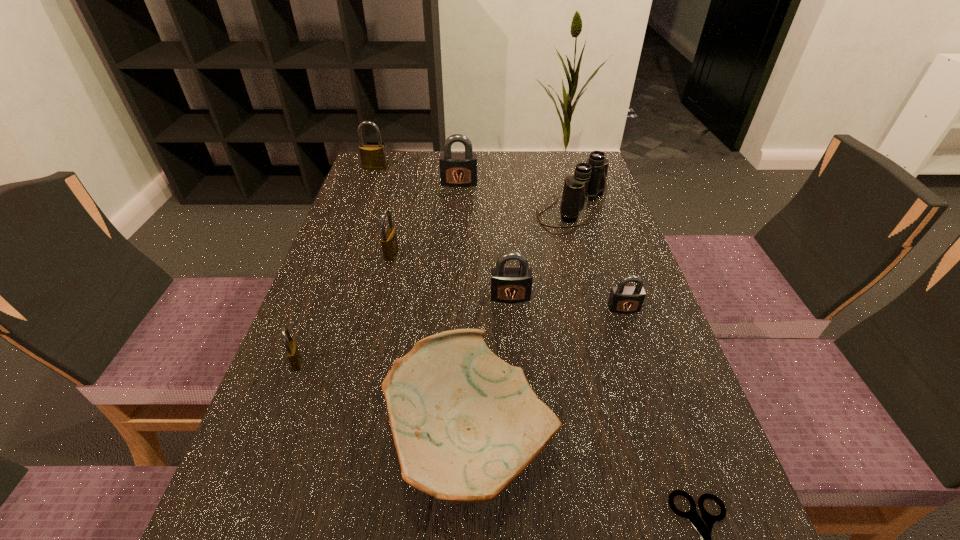
At what (x,y) coordinates should I click in order to perform the action: click on blank area at the far left corner. Please return your answer as a coordinate pair (x, y). Image resolution: width=960 pixels, height=540 pixels. Looking at the image, I should click on (366, 184).

Locate an element on the screen. free spot at the far right corner of the desktop is located at coordinates (555, 167).

The width and height of the screenshot is (960, 540). I want to click on free space between the nearest padlock and the second farthest padlock, so click(x=378, y=272).

In order to click on empty space that is in between the binoculars and the third padlock from left to right in this screenshot , I will do tap(482, 232).

Identify the location of free space between the binoculars and the pottery. This screenshot has width=960, height=540. (521, 325).

At what (x,y) coordinates should I click in order to perform the action: click on vacant space that is in between the pottery and the rightmost padlock. Please return your answer as a coordinate pair (x, y). This screenshot has width=960, height=540. Looking at the image, I should click on point(547,373).

Find the location of a particular element. This screenshot has width=960, height=540. vacant area that lies between the biggest brass padlock and the smallest brass padlock is located at coordinates (336, 265).

Where is `free point between the binoculars and the smallest brass padlock`? Image resolution: width=960 pixels, height=540 pixels. free point between the binoculars and the smallest brass padlock is located at coordinates (435, 286).

Where is `free area in between the binoculars and the second smallest gray padlock`? The image size is (960, 540). free area in between the binoculars and the second smallest gray padlock is located at coordinates click(541, 254).

At what (x,y) coordinates should I click in order to perform the action: click on free point between the fourth padlock from left to right and the pottery. Please return your answer as a coordinate pair (x, y). The width and height of the screenshot is (960, 540). Looking at the image, I should click on (465, 310).